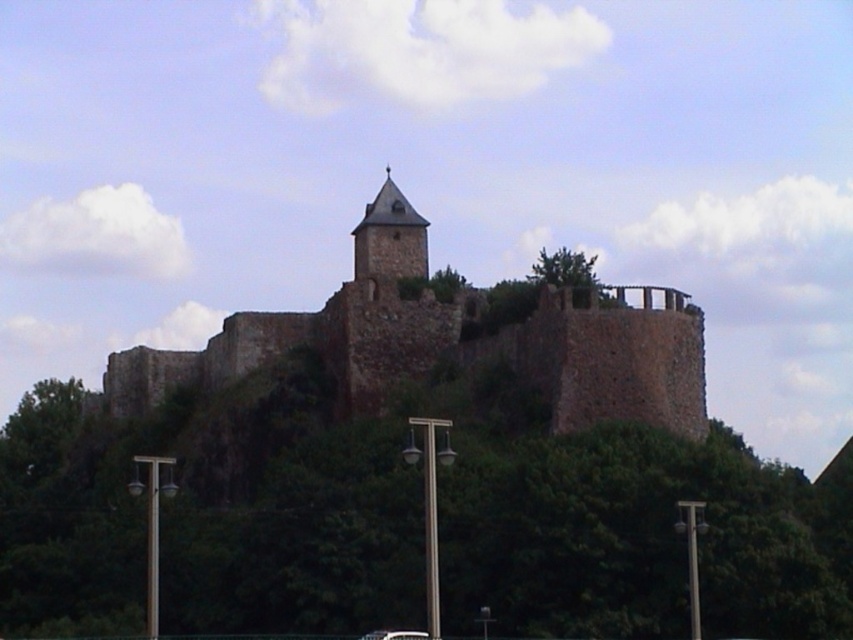
Based on the photo, you are a tourist visiting the historic site and want to take a photo that captures both the brown stone castle at center and the rustic stone tower at center in the same frame. Considering their heights, which object should you position closer to the bottom of the frame to ensure both are fully visible?

Since the brown stone castle at center is taller than the rustic stone tower at center, you should position the brown stone castle at center closer to the bottom of the frame to ensure both are fully visible in the photo.

From the picture: You are standing at the base of the hill looking up at the brown stone castle at center and the rustic stone tower at center. Which structure will appear larger to you?

The brown stone castle at center will appear larger because it is closer to the viewer than the rustic stone tower at center.